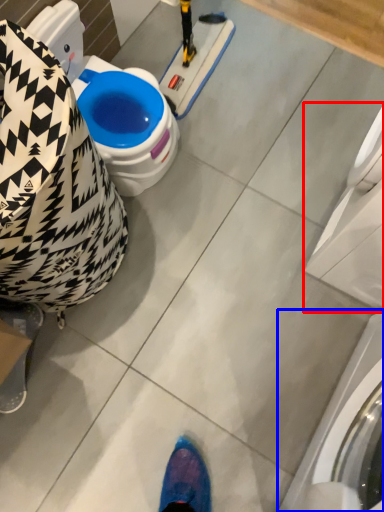
Question: Among these objects, which one is nearest to the camera, washing machine (highlighted by a red box) or washing machine (highlighted by a blue box)?

Choices:
 (A) washing machine
 (B) washing machine

Answer: (B)